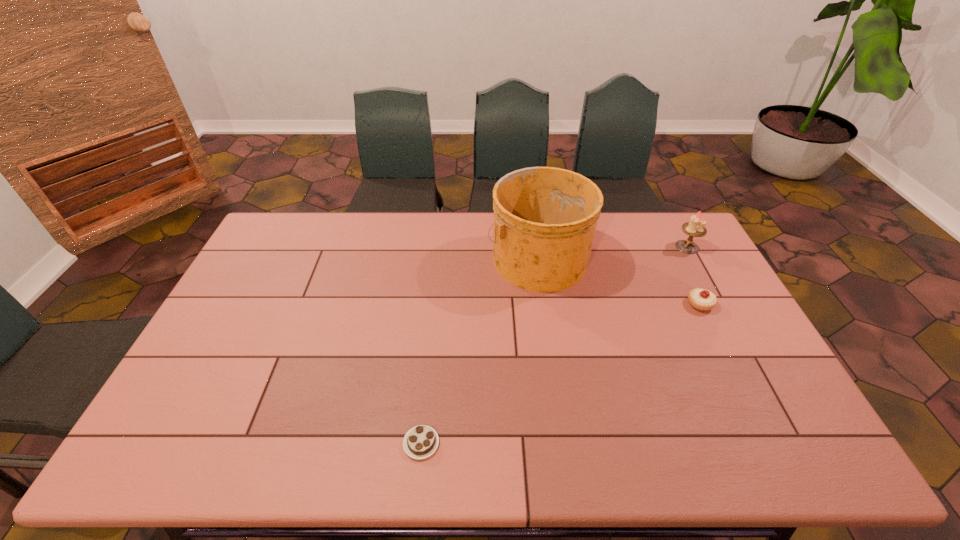
In order to click on the second object from left to right in this screenshot , I will do `click(545, 218)`.

At what (x,y) coordinates should I click in order to perform the action: click on the tallest object. Please return your answer as a coordinate pair (x, y). This screenshot has height=540, width=960. Looking at the image, I should click on (545, 218).

The width and height of the screenshot is (960, 540). What are the coordinates of `candle holder` in the screenshot? It's located at (694, 228).

Locate an element on the screen. The width and height of the screenshot is (960, 540). the second nearest object is located at coordinates (700, 299).

You are a GUI agent. You are given a task and a screenshot of the screen. Output one action in this format:
    pyautogui.click(x=<x>, y=<y>)
    Task: Click on the pastry
    Image resolution: width=960 pixels, height=540 pixels.
    Given the screenshot: What is the action you would take?
    coord(700,299)

You are a GUI agent. You are given a task and a screenshot of the screen. Output one action in this format:
    pyautogui.click(x=<x>, y=<y>)
    Task: Click on the leftmost object
    This screenshot has height=540, width=960.
    Given the screenshot: What is the action you would take?
    pyautogui.click(x=420, y=442)

Image resolution: width=960 pixels, height=540 pixels. What are the coordinates of `chocolate cake` in the screenshot? It's located at (420, 442).

Identify the location of vacant position located 0.190m on the left of the bucket. (434, 258).

This screenshot has width=960, height=540. In order to click on free space located 0.170m on the back of the candle holder in this screenshot , I will do `click(669, 213)`.

Locate an element on the screen. free space located on the back of the third farthest object is located at coordinates (673, 251).